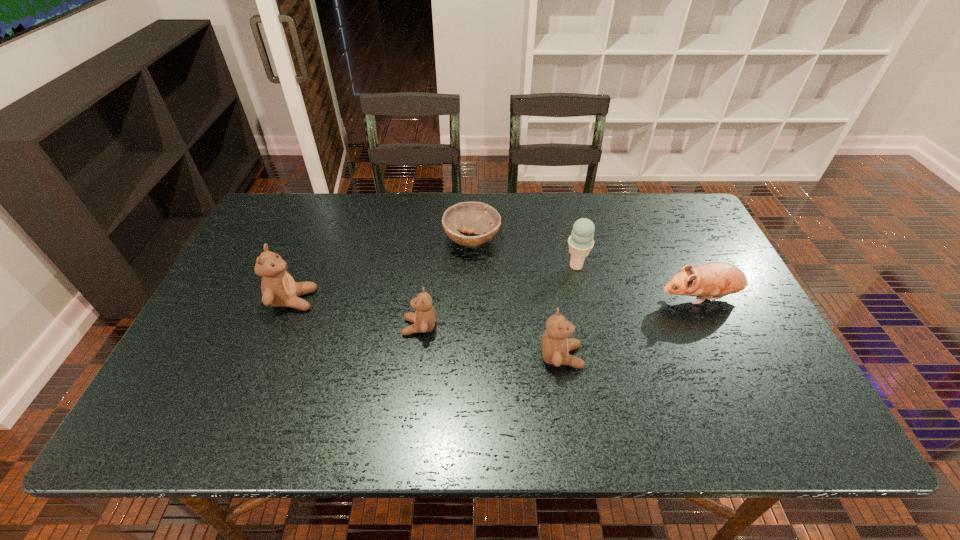
Please point a free position for a teddy bear on the right. Please provide its 2D coordinates. Your answer should be formatted as a tuple, i.e. [(x, y)], where the tuple contains the x and y coordinates of a point satisfying the conditions above.

[(721, 390)]